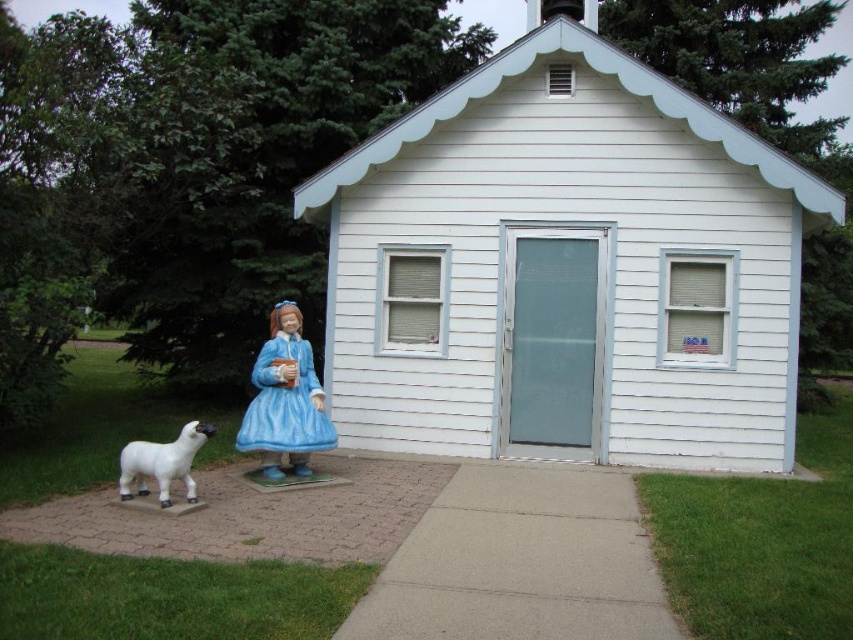
You are a visitor approaching the white painted wood chapel at center and the blue glossy dress at center. Which object is closer to you as you walk towards them?

The blue glossy dress at center is closer because the white painted wood chapel at center is positioned over it, indicating the dress is in front.

Based on the provided scene description, what are the coordinates of the blue glossy dress at center?

The blue glossy dress at center is located at coordinates point (285, 403).